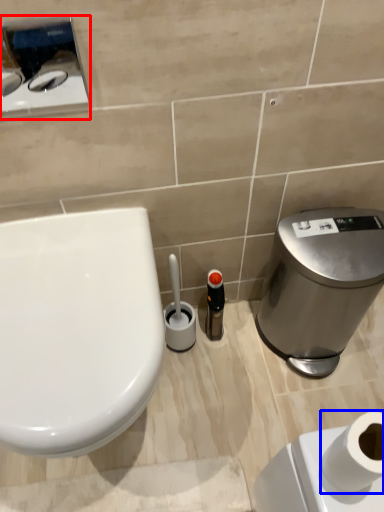
Question: Which of the following is the closest to the observer, appliance (highlighted by a red box) or toilet paper (highlighted by a blue box)?

Choices:
 (A) appliance
 (B) toilet paper

Answer: (B)